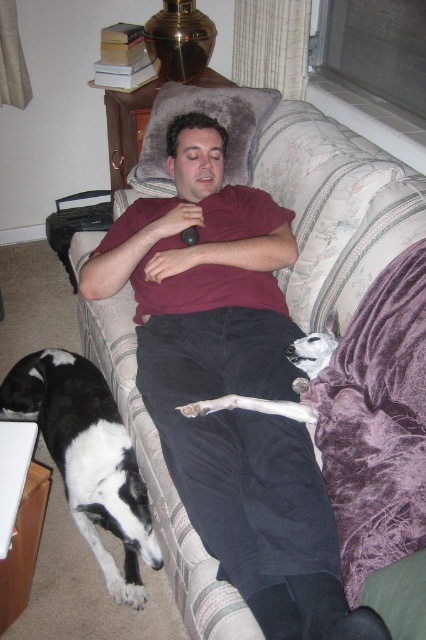
Question: Does black and white fur at lower left have a greater width compared to fuzzy gray pillow at upper center?

Choices:
 (A) yes
 (B) no

Answer: (B)

Question: Estimate the real-world distances between objects in this image. Which object is closer to the fuzzy gray pillow at upper center?

Choices:
 (A) black and white fur at lower left
 (B) white fur dog at lower left
 (C) white fur dog at lower right

Answer: (C)

Question: Can you confirm if white fur dog at lower left is thinner than white fur dog at lower right?

Choices:
 (A) yes
 (B) no

Answer: (B)

Question: Does velvet-like couch at center have a larger size compared to black and white fur at lower left?

Choices:
 (A) no
 (B) yes

Answer: (B)

Question: Estimate the real-world distances between objects in this image. Which object is farther from the velvet-like couch at center?

Choices:
 (A) black and white fur at lower left
 (B) white fur dog at lower right

Answer: (A)

Question: Which object is positioned farthest from the black and white fur at lower left?

Choices:
 (A) velvet-like couch at center
 (B) fuzzy gray pillow at upper center
 (C) white fur dog at lower left
 (D) white fur dog at lower right

Answer: (B)